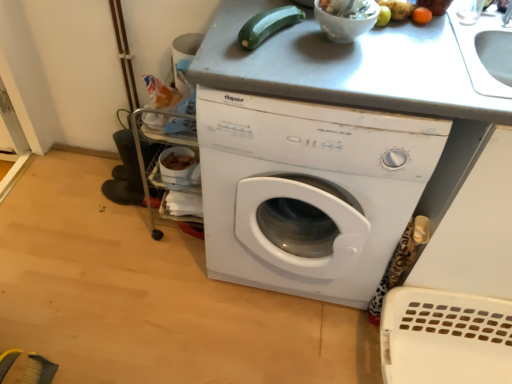
Locate an element on the screen. vacant space to the right of green matte zucchini at upper center, the 2th vegetable from the right is located at coordinates (326, 49).